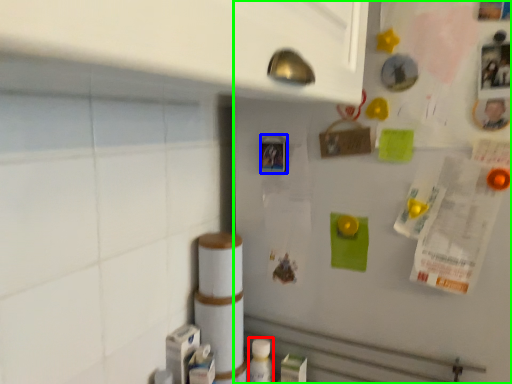
Question: Considering the real-world distances, which object is closest to bottle (highlighted by a red box)? button (highlighted by a blue box) or fridge (highlighted by a green box).

Choices:
 (A) button
 (B) fridge

Answer: (B)